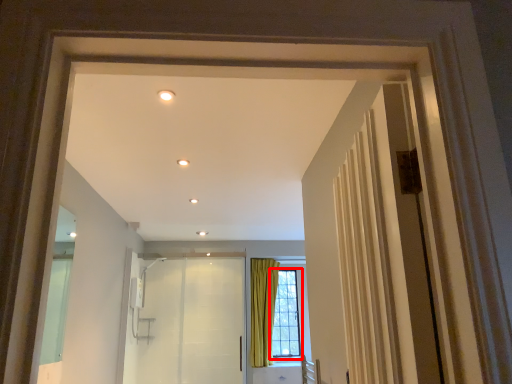
Question: From the image's perspective, what is the correct spatial relationship of window (annotated by the red box) in relation to elevator?

Choices:
 (A) below
 (B) above

Answer: (A)